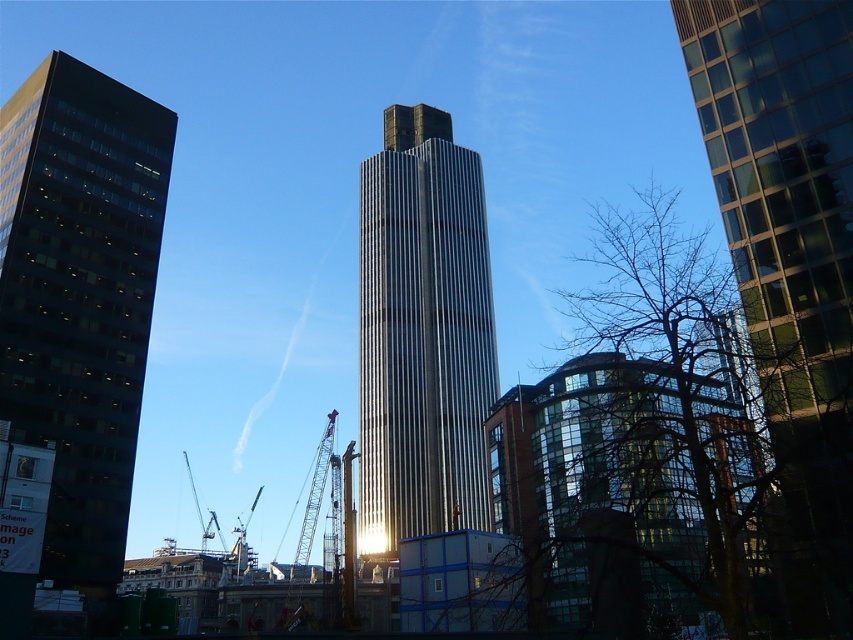
You are standing at the origin point of the coordinate system, which is the bottom left corner of the image. The glassy reflective skyscraper at center is located at coordinates approximately where?

The glassy reflective skyscraper at center is located at coordinates approximately 0.405 on the x axis and 0.926 on the y axis.

You are standing in the middle of the city and want to take a photo of the glassy reflective skyscraper at center and the metallic silver tower at center. Which one will appear larger in your camera view?

The glassy reflective skyscraper at center will appear larger in your camera view because it is closer to the viewer than the metallic silver tower at center.

You are standing at the center of the urban landscape and want to take a photo of the glassy reflective skyscraper at center. Given that your camera can only capture objects within a 0.4 radius from your position, will the skyscraper be in frame?

The glassy reflective skyscraper at center is located at point [788,259]. Since the distance from the center to this point is sqrt0.4052 0.9262, which is approximately 1.01, greater than 0.4, the skyscraper will not be in frame.